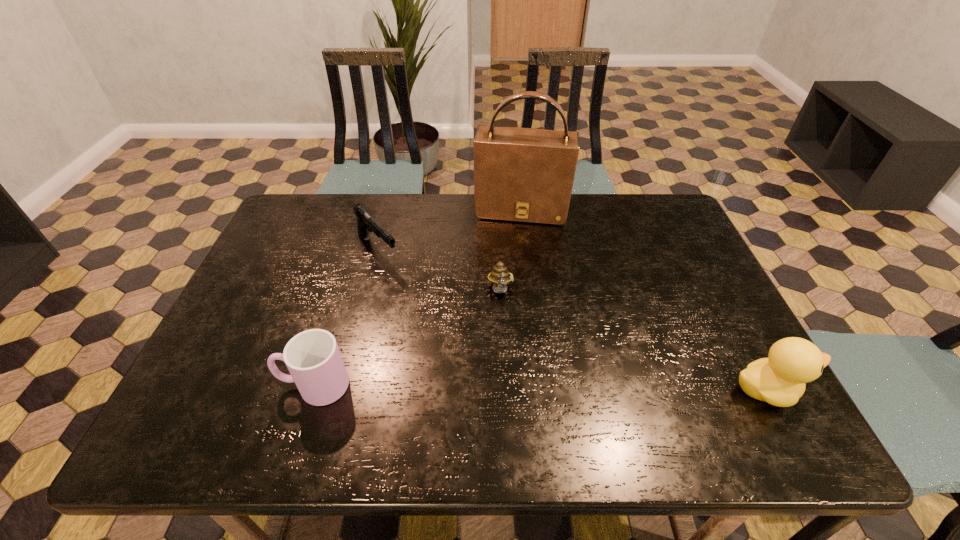
Point out which object is positioned as the fourth nearest to the tallest object. Please provide its 2D coordinates. Your answer should be formatted as a tuple, i.e. [(x, y)], where the tuple contains the x and y coordinates of a point satisfying the conditions above.

[(780, 380)]

Identify which object is the second nearest to the cup. Please provide its 2D coordinates. Your answer should be formatted as a tuple, i.e. [(x, y)], where the tuple contains the x and y coordinates of a point satisfying the conditions above.

[(500, 277)]

Where is `free space that satisfies the following two spatial constraints: 1. on the front side of the duck; 2. on the face of the third nearest object`? This screenshot has height=540, width=960. free space that satisfies the following two spatial constraints: 1. on the front side of the duck; 2. on the face of the third nearest object is located at coordinates (505, 390).